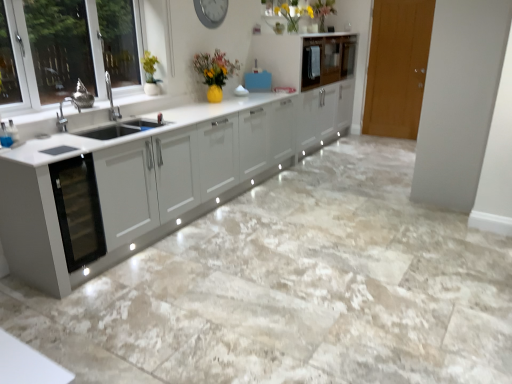
Find the location of `free space to the left of wooden door at right`. free space to the left of wooden door at right is located at coordinates (365, 140).